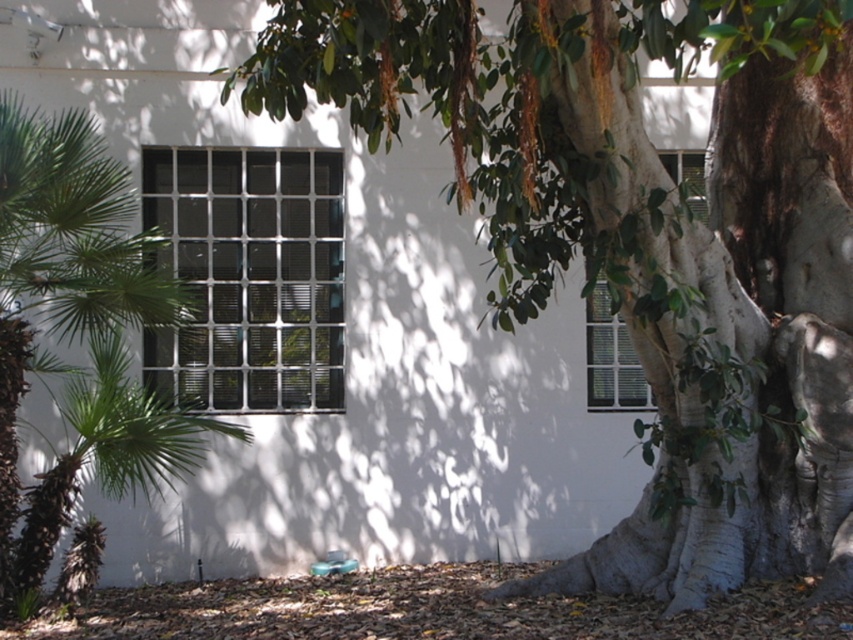
Question: Considering the real-world distances, which object is closest to the green leafy tree at center?

Choices:
 (A) green leafy palm tree at left
 (B) clear glass window at center
 (C) white matte window at center
 (D) white grid glass window at right

Answer: (A)

Question: Does green leafy tree at center have a greater width compared to white grid glass window at right?

Choices:
 (A) yes
 (B) no

Answer: (A)

Question: Which object is positioned farthest from the white grid glass window at right?

Choices:
 (A) white matte window at center
 (B) green leafy palm tree at left

Answer: (B)

Question: Estimate the real-world distances between objects in this image. Which object is farther from the clear glass window at center?

Choices:
 (A) green leafy palm tree at left
 (B) white matte window at center
 (C) green leafy tree at center
 (D) white grid glass window at right

Answer: (C)

Question: Is white grid glass window at right positioned in front of white matte window at center?

Choices:
 (A) yes
 (B) no

Answer: (A)

Question: Does white grid glass window at right have a lesser width compared to white matte window at center?

Choices:
 (A) no
 (B) yes

Answer: (B)